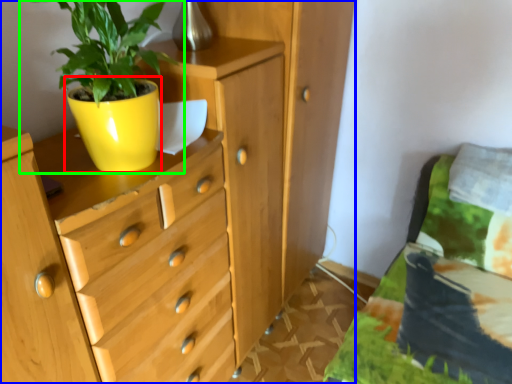
Question: Which is nearer to the flowerpot (highlighted by a red box)? chest of drawers (highlighted by a blue box) or houseplant (highlighted by a green box).

Choices:
 (A) chest of drawers
 (B) houseplant

Answer: (B)